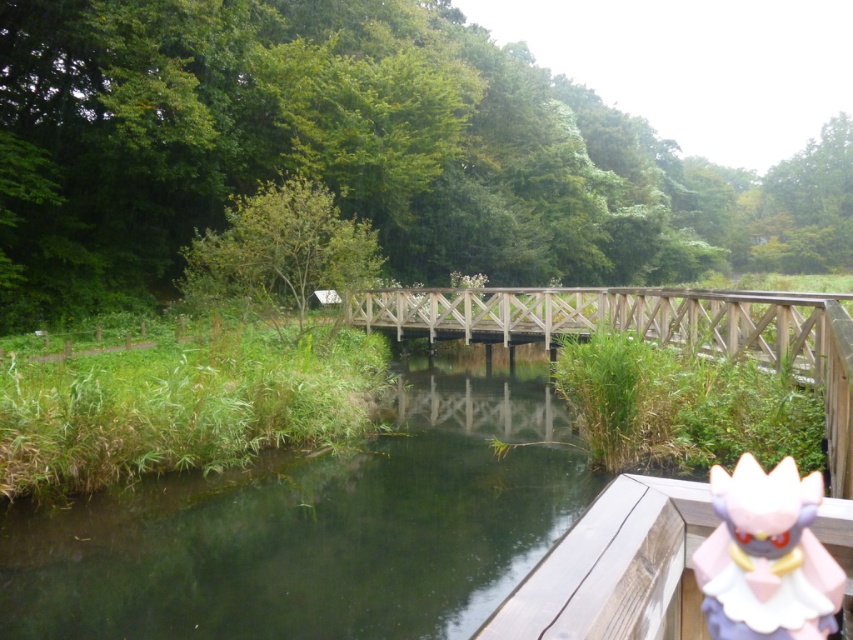
Find the location of `wooden bridge at center`. wooden bridge at center is located at coordinates (650, 330).

Looking at this image, who is more forward, (x=485, y=328) or (x=808, y=516)?

Point (x=808, y=516)

Find the location of a particular element. The width and height of the screenshot is (853, 640). wooden bridge at center is located at coordinates click(x=650, y=330).